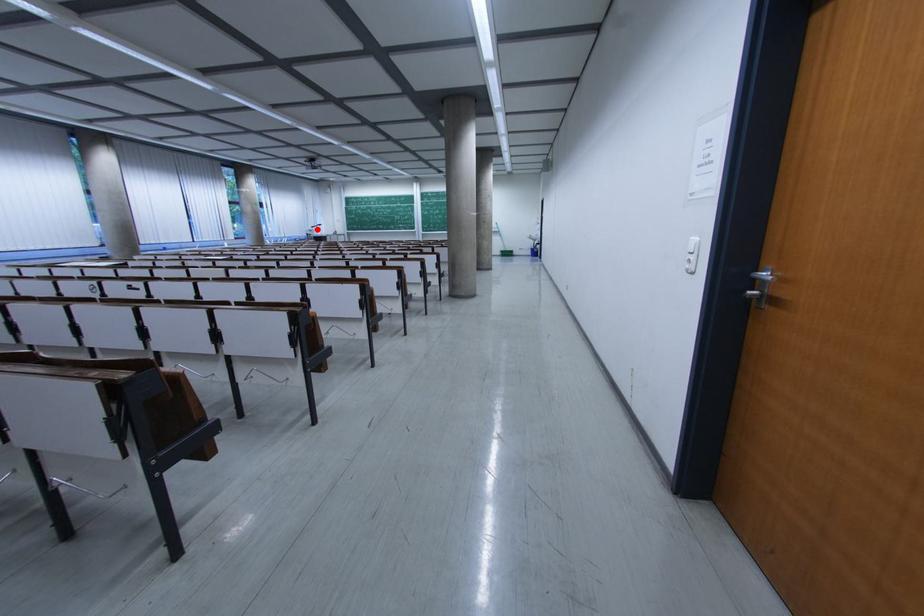
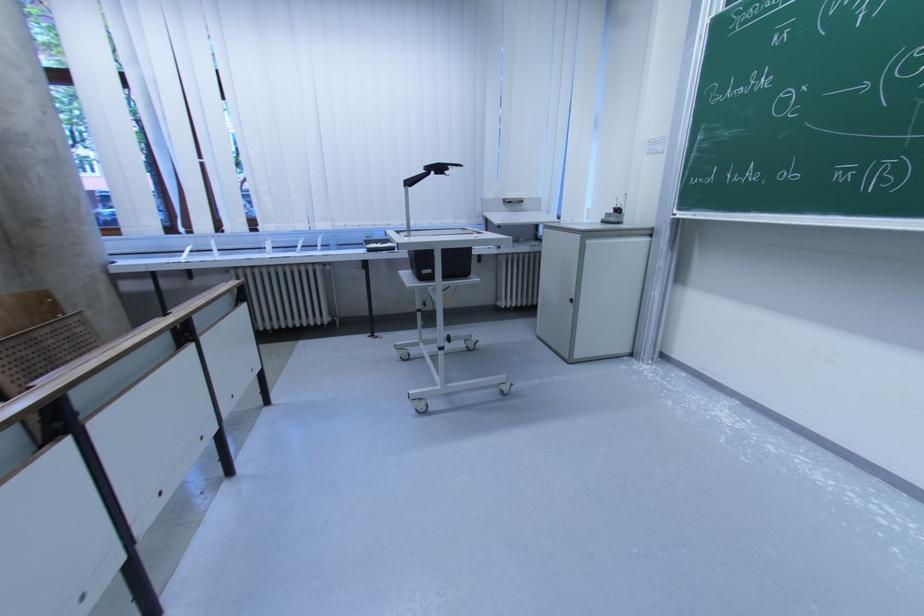
Question: I am providing you with two images of the same scene from different viewpoints. Image1 has a red point marked. In image2, the corresponding 3D location appears at what relative position? Reply with the corresponding letter.

Choices:
 (A) Closer
 (B) Farther

Answer: (B)